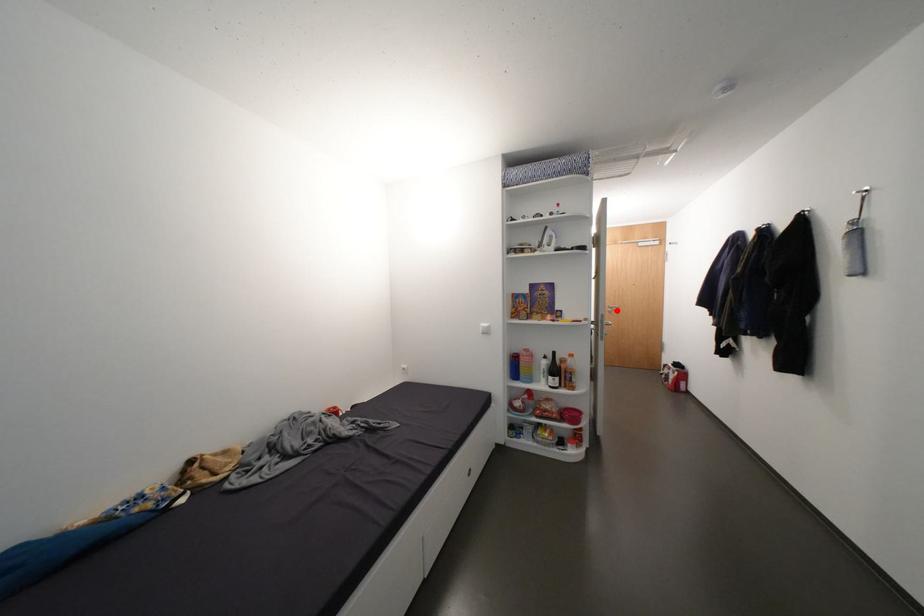
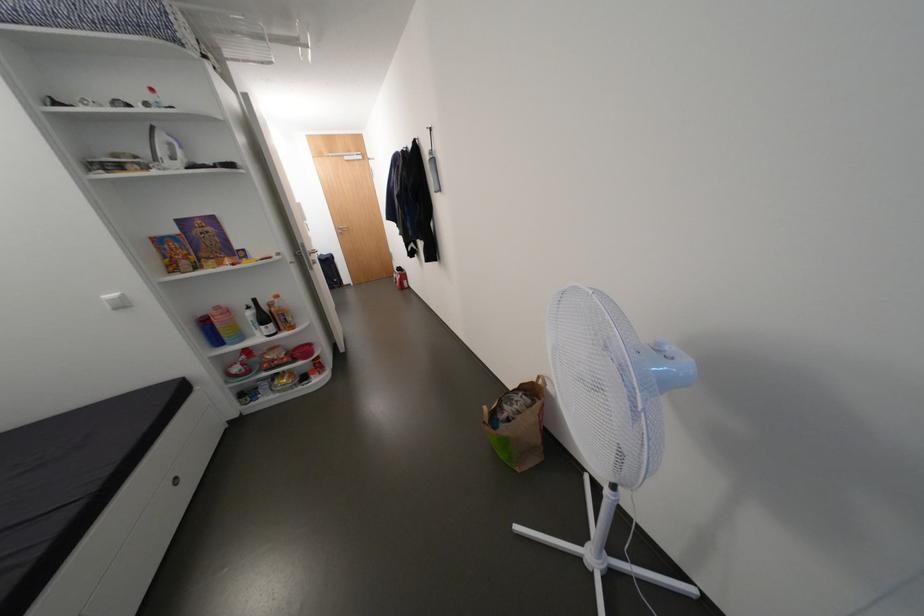
Question: I am providing you with two images of the same scene from different viewpoints. Given a red point in image1, look at the same physical point in image2. Is it:

Choices:
 (A) Closer to the viewpoint
 (B) Farther from the viewpoint

Answer: (A)